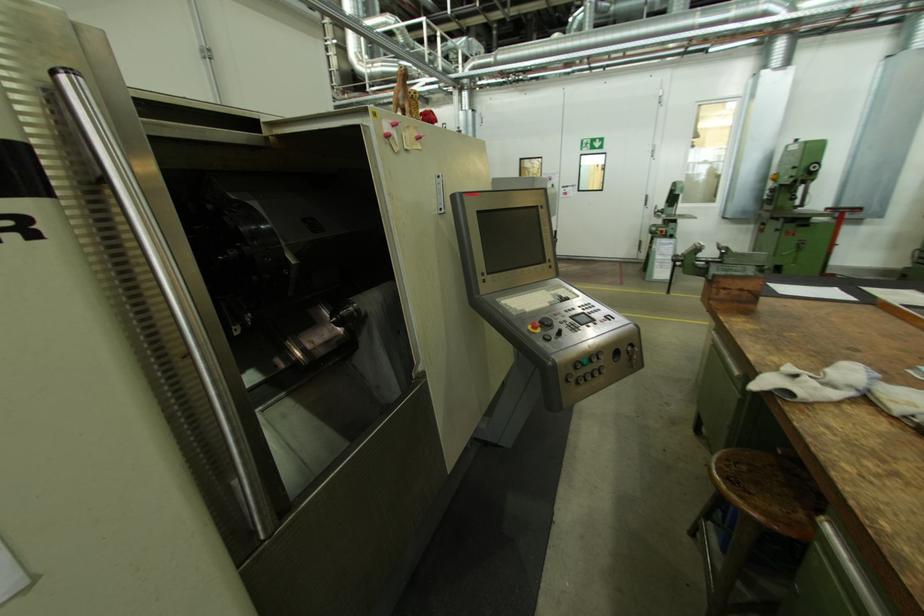
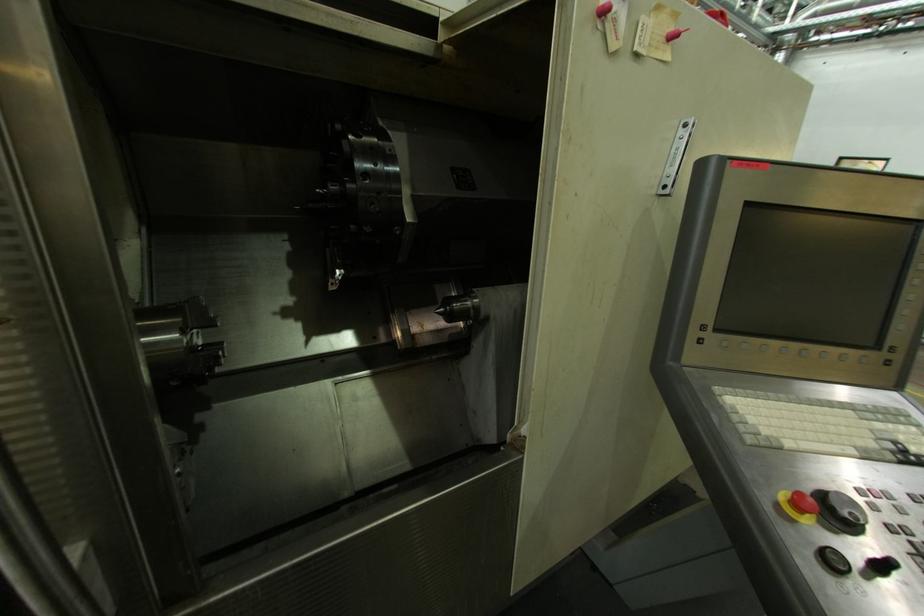
Question: Based on the continuous images, in which direction is the camera rotating? Reply with the corresponding letter.

Choices:
 (A) Left
 (B) Right
 (C) Up
 (D) Down

Answer: (A)